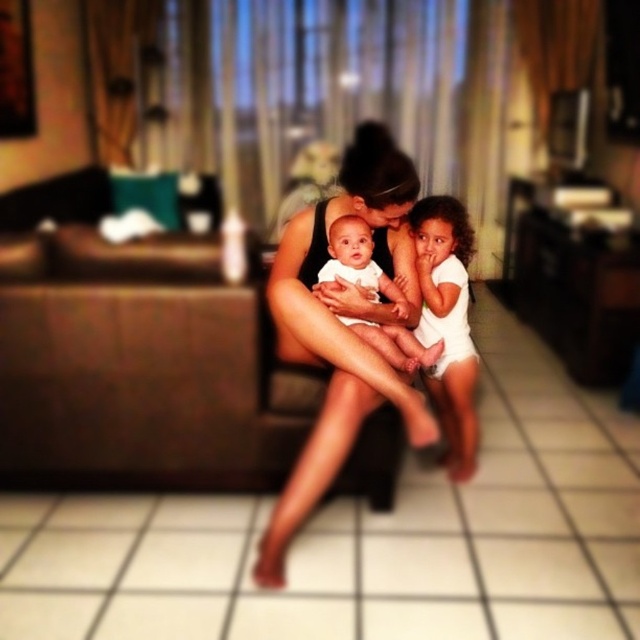
Does point (300, 342) come behind point (465, 353)?

No, (300, 342) is in front of (465, 353).

Can you confirm if matte black tank top at center is positioned below white cotton onesie at center?

Indeed, matte black tank top at center is positioned under white cotton onesie at center.

This screenshot has height=640, width=640. What do you see at coordinates (342, 324) in the screenshot?
I see `matte black tank top at center` at bounding box center [342, 324].

Where is `matte black tank top at center`? The image size is (640, 640). matte black tank top at center is located at coordinates (342, 324).

Does white cotton onesie at center have a lesser height compared to white matte baby at center?

In fact, white cotton onesie at center may be taller than white matte baby at center.

Which is more to the right, white cotton onesie at center or white matte baby at center?

white cotton onesie at center

Find the location of a particular element. white cotton onesie at center is located at coordinates (448, 323).

Image resolution: width=640 pixels, height=640 pixels. Identify the location of white cotton onesie at center. (448, 323).

Between point (289, 256) and point (417, 355), which one is positioned behind?

The point (289, 256) is more distant.

The width and height of the screenshot is (640, 640). What do you see at coordinates (342, 324) in the screenshot?
I see `matte black tank top at center` at bounding box center [342, 324].

Between point (321, 410) and point (360, 330), which one is positioned in front?

Point (321, 410)

What are the coordinates of `matte black tank top at center` in the screenshot? It's located at (342, 324).